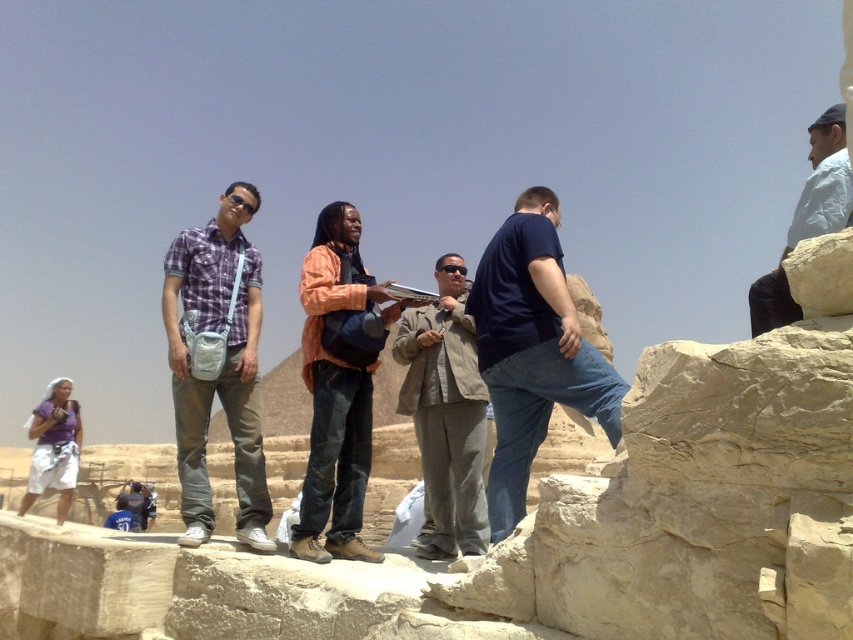
You are a photographer trying to capture a photo of the dark blue denim jeans at center. The camera you are using has a focal length of 50mm and an aperture of f2.8. You want to ensure that the jeans are in focus. What is the minimum distance you need to be from the jeans to achieve this focus?

The minimum distance required to achieve focus on the dark blue denim jeans at center cannot be determined with the provided information. The position coordinates alone do not provide sufficient data about depth of field or distance from the camera.

What is located at the coordinates point (221, 369) in the image?

The plaid cotton shirt at center is located at point (221, 369).

You are a photographer trying to capture a photo of the historical site. You want to ensure that both the dark blue denim jeans at center and the white cotton shirt at upper right are clearly visible in the frame. Based on their positions, which of the two is closer to the camera?

The dark blue denim jeans at center is in front of the white cotton shirt at upper right, so it is closer to the camera.